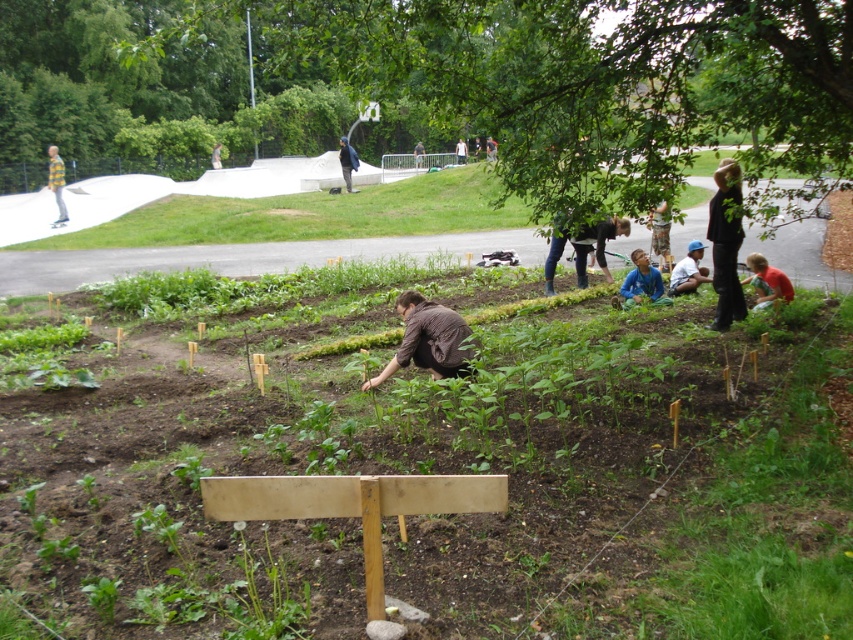
You are a photographer trying to capture a photo of the gardening group. You notice the blue fabric shirt at center and the yellow striped shirt at left. Which person should you focus on first if you want to include both in your shot without moving the camera?

You should focus on the yellow striped shirt at left first because it is above the blue fabric shirt at center, allowing both to be captured in the frame without moving the camera.

You are a drone operator trying to capture a closeup of the raised garden bed. You have two points marked in the scene, point A at coordinates point (349, 179) and point B at coordinates point (215, 150). Which point should you focus on to get a clearer image of the garden bed details?

Point A at coordinates point (349, 179) is closer to the camera than point B at coordinates point (215, 150), so focusing on point A will provide a clearer image of the garden bed details.

You are a photographer trying to capture both the dark brown leather jacket at center and the light brown shirt at center in a single frame. Based on their sizes, which one will appear bigger in the photo?

The dark brown leather jacket at center will appear bigger in the photo because it has a larger size compared to the light brown shirt at center.